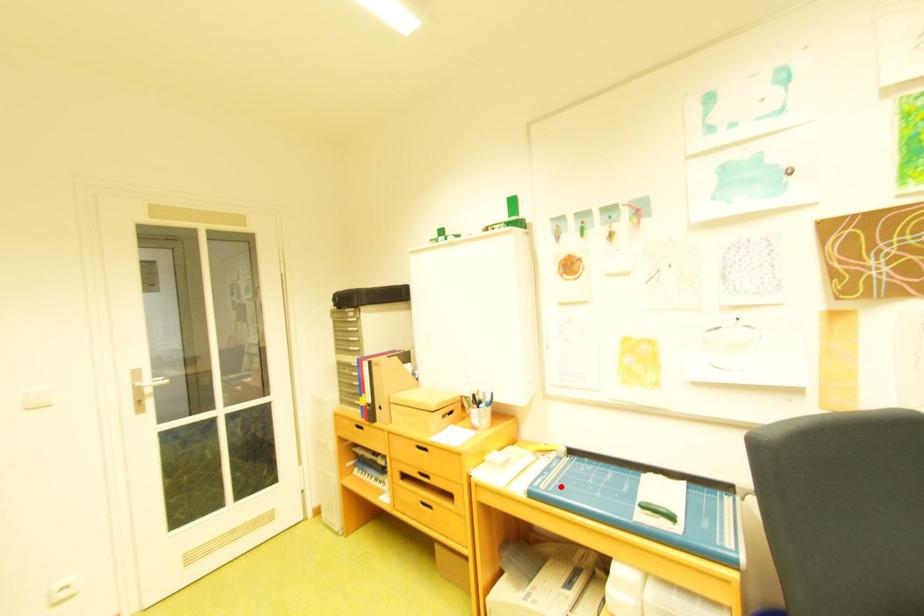
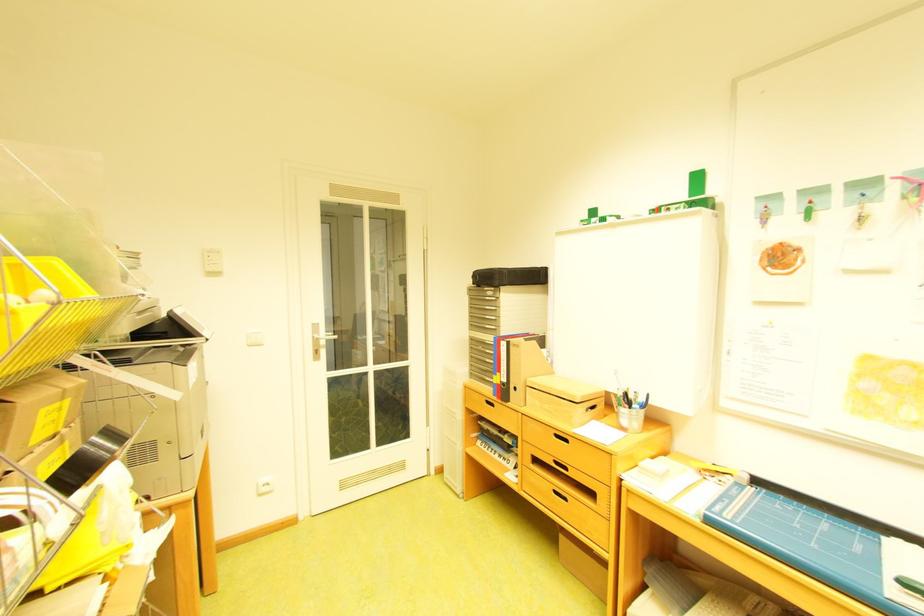
In the second image, find the point that corresponds to the highlighted location in the first image.

(747, 517)